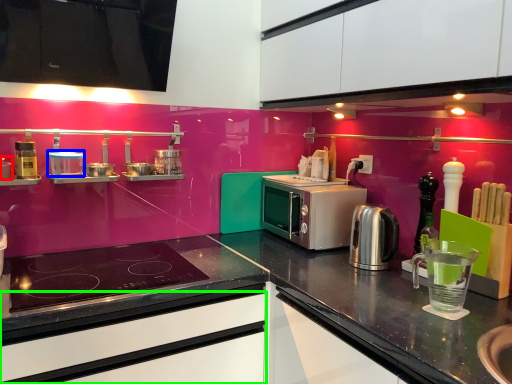
Question: Which is nearer to the appliance (highlighted by a red box)? appliance (highlighted by a blue box) or drawer (highlighted by a green box).

Choices:
 (A) appliance
 (B) drawer

Answer: (A)